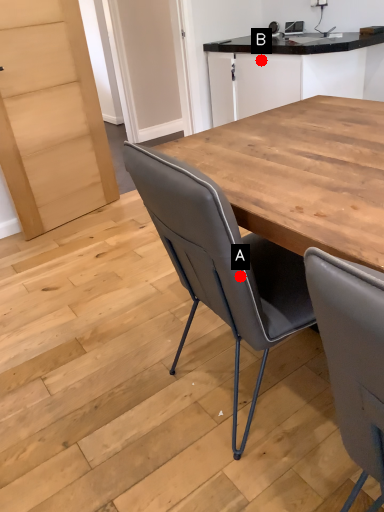
Question: Two points are circled on the image, labeled by A and B beside each circle. Which point is closer to the camera?

Choices:
 (A) A is closer
 (B) B is closer

Answer: (A)